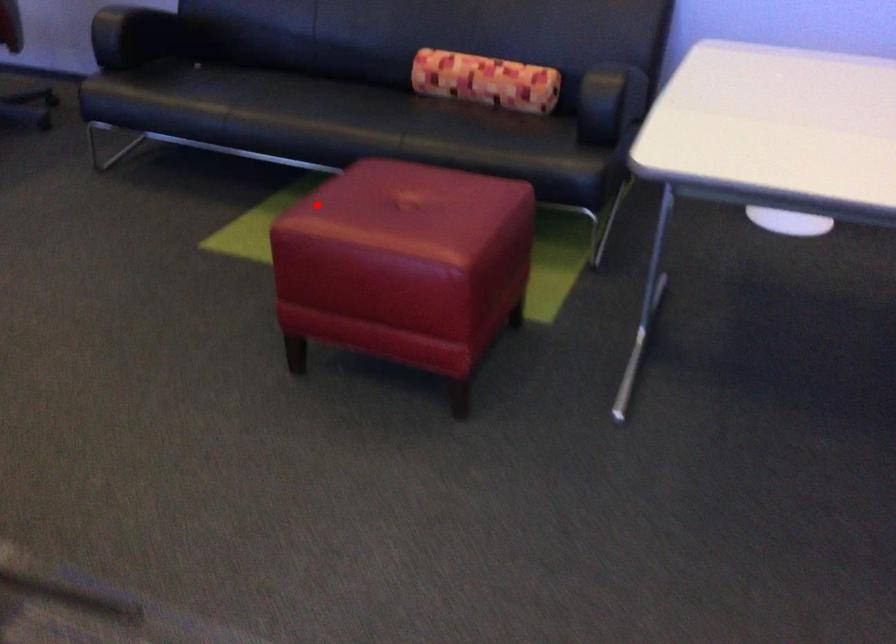
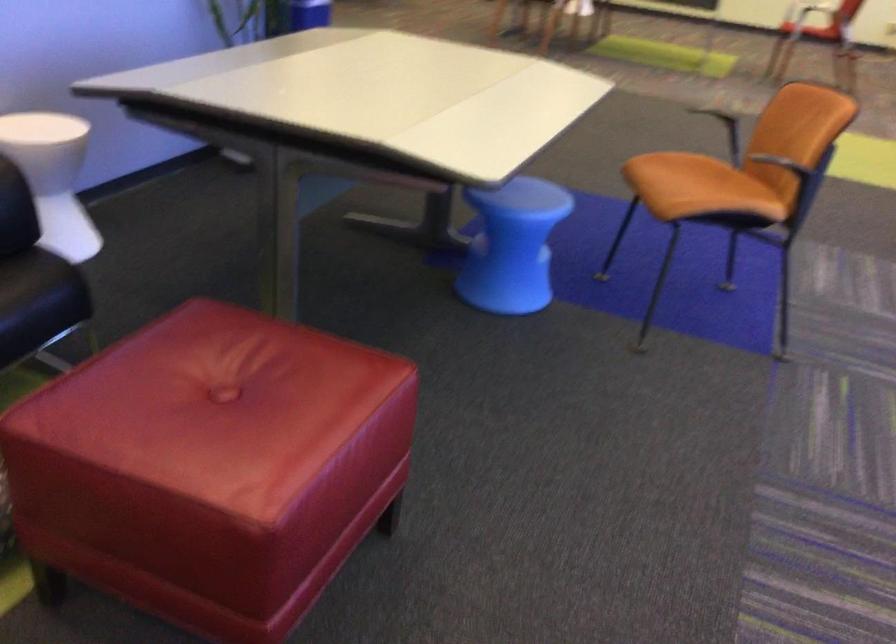
The point at the highlighted location is marked in the first image. Where is the corresponding point in the second image?

(211, 466)